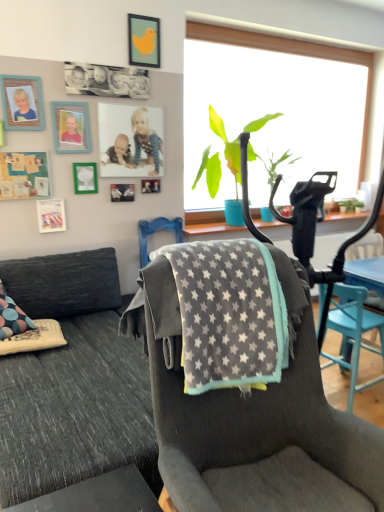
Question: Can you confirm if metallic silver picture frame at upper left, which appears as the fifth picture frame when ordered from the bottom, is smaller than gray fabric chair at center, which ranks as the 2th chair in left-to-right order?

Choices:
 (A) no
 (B) yes

Answer: (B)

Question: Is metallic silver picture frame at upper left, marked as the 5th picture frame in a top-to-bottom arrangement, outside of gray fabric chair at center, which ranks as the 1th chair in back-to-front order?

Choices:
 (A) yes
 (B) no

Answer: (A)

Question: Is metallic silver picture frame at upper left, which appears as the fifth picture frame when ordered from the bottom, looking in the opposite direction of gray fabric chair at center, which ranks as the 2th chair in left-to-right order?

Choices:
 (A) yes
 (B) no

Answer: (B)

Question: Is metallic silver picture frame at upper left, marked as the 5th picture frame in a top-to-bottom arrangement, far away from gray fabric chair at center, arranged as the first chair when viewed from the right?

Choices:
 (A) yes
 (B) no

Answer: (A)

Question: Is metallic silver picture frame at upper left, marked as the 5th picture frame in a top-to-bottom arrangement, at the left side of gray fabric chair at center, arranged as the first chair when viewed from the right?

Choices:
 (A) yes
 (B) no

Answer: (A)

Question: Considering the relative sizes of metallic silver picture frame at upper left, which appears as the fifth picture frame when ordered from the bottom, and gray fabric chair at center, which ranks as the 2th chair in left-to-right order, in the image provided, is metallic silver picture frame at upper left, which appears as the fifth picture frame when ordered from the bottom, wider than gray fabric chair at center, which ranks as the 2th chair in left-to-right order,?

Choices:
 (A) no
 (B) yes

Answer: (A)

Question: Is green leafy plant at center positioned far away from wooden photo frame at upper left, placed as the second picture frame when sorted from top to bottom?

Choices:
 (A) yes
 (B) no

Answer: (A)

Question: Is green leafy plant at center thinner than wooden photo frame at upper left, placed as the second picture frame when sorted from top to bottom?

Choices:
 (A) no
 (B) yes

Answer: (A)

Question: From a real-world perspective, is green leafy plant at center below wooden photo frame at upper left, placed as the eighth picture frame when sorted from bottom to top?

Choices:
 (A) yes
 (B) no

Answer: (A)

Question: From the image's perspective, is green leafy plant at center under wooden photo frame at upper left, placed as the eighth picture frame when sorted from bottom to top?

Choices:
 (A) yes
 (B) no

Answer: (A)

Question: Is wooden photo frame at upper left, placed as the eighth picture frame when sorted from bottom to top, at the back of green leafy plant at center?

Choices:
 (A) yes
 (B) no

Answer: (B)

Question: Considering the relative positions of green leafy plant at center and wooden photo frame at upper left, placed as the second picture frame when sorted from top to bottom, in the image provided, is green leafy plant at center to the right of wooden photo frame at upper left, placed as the second picture frame when sorted from top to bottom, from the viewer's perspective?

Choices:
 (A) no
 (B) yes

Answer: (B)

Question: Is matte plastic photo frame at upper center, which is the fourth picture frame from top to bottom, taller than gray fabric chair at center, placed as the 2th chair when sorted from front to back?

Choices:
 (A) no
 (B) yes

Answer: (A)